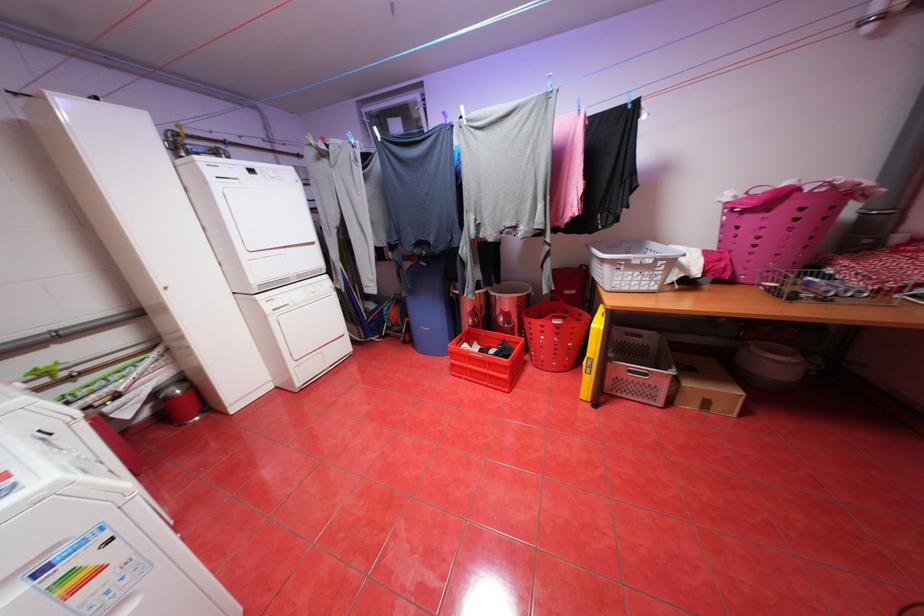
What do you see at coordinates (485, 359) in the screenshot?
I see `the red bin pedal` at bounding box center [485, 359].